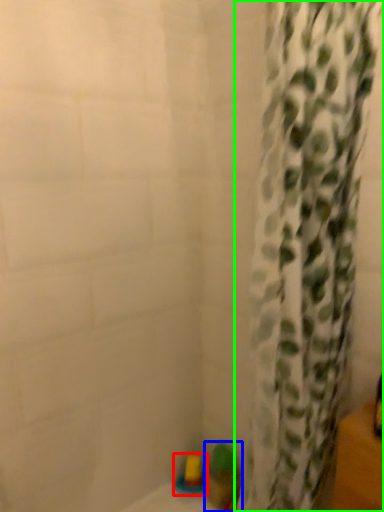
Question: Based on their relative distances, which object is farther from toy (highlighted by a red box)? Choose from toy (highlighted by a blue box) and curtain (highlighted by a green box).

Choices:
 (A) toy
 (B) curtain

Answer: (B)